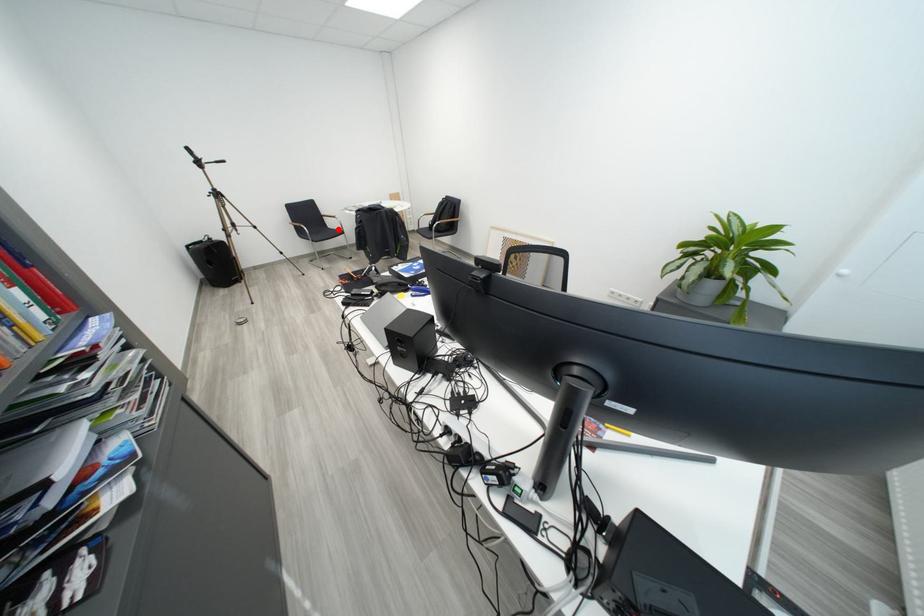
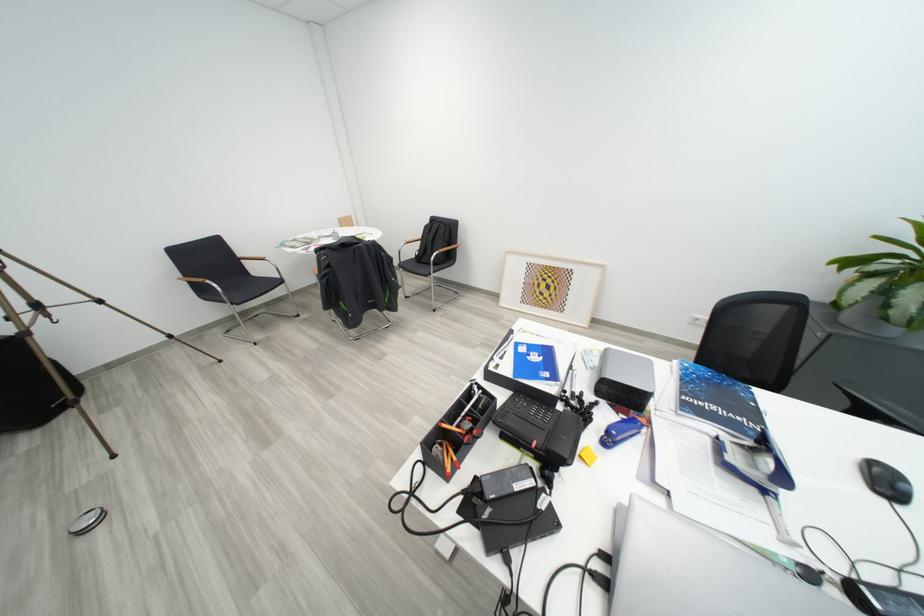
Question: I am providing you with two images of the same scene from different viewpoints. Image1 has a red point marked. In image2, the corresponding 3D location appears at what relative position? Reply with the corresponding letter.

Choices:
 (A) Closer
 (B) Farther

Answer: (A)